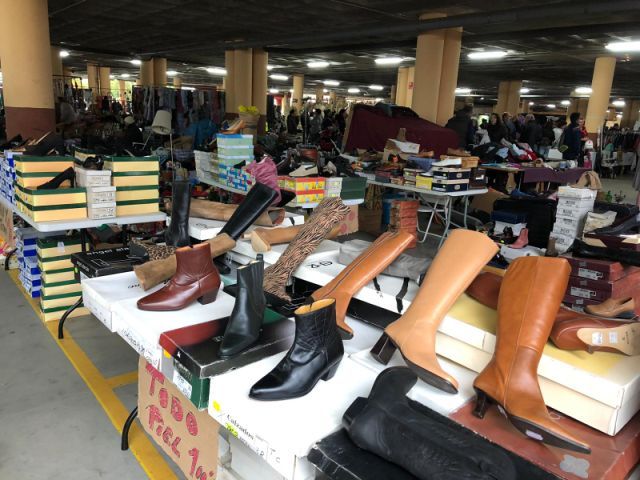
The width and height of the screenshot is (640, 480). Find the location of `support poles`. support poles is located at coordinates (38, 92), (246, 76), (444, 89), (598, 85), (506, 102), (299, 92), (404, 80), (102, 83), (152, 77).